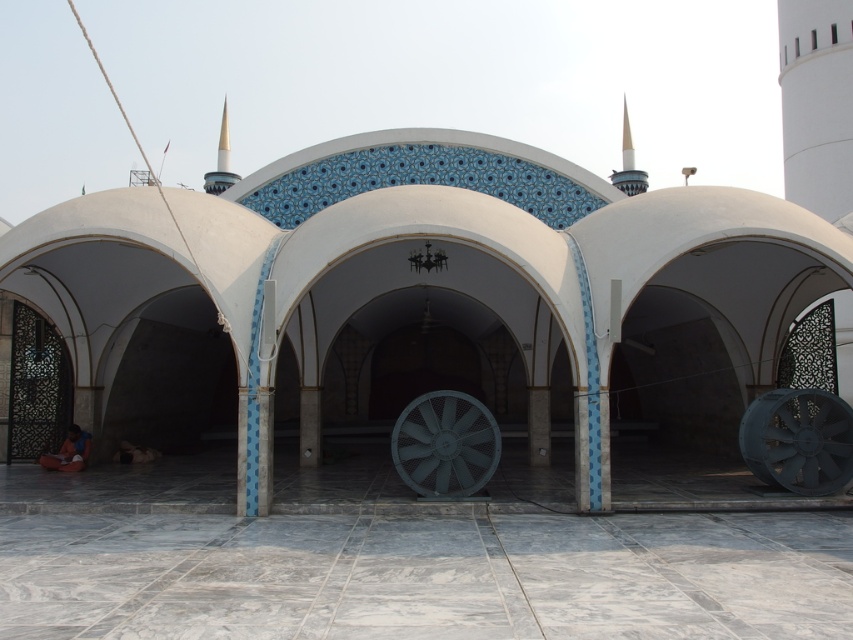
You are an engineer inspecting the ventilation system of this architectural structure. You need to determine which fan has a larger diameter to assess airflow capacity. Which fan is wider between the metallic gray fan at lower right and the gray metallic fan at center?

The gray metallic fan at center is wider than the metallic gray fan at lower right, so it has a larger diameter and greater airflow capacity.

You are an engineer inspecting the structure and need to determine which fan has a larger diameter. You see the metallic gray fan at lower right and the gray metallic fan at center. Which one is bigger?

The metallic gray fan at lower right is bigger than the gray metallic fan at center, so the metallic gray fan at lower right has a larger diameter.